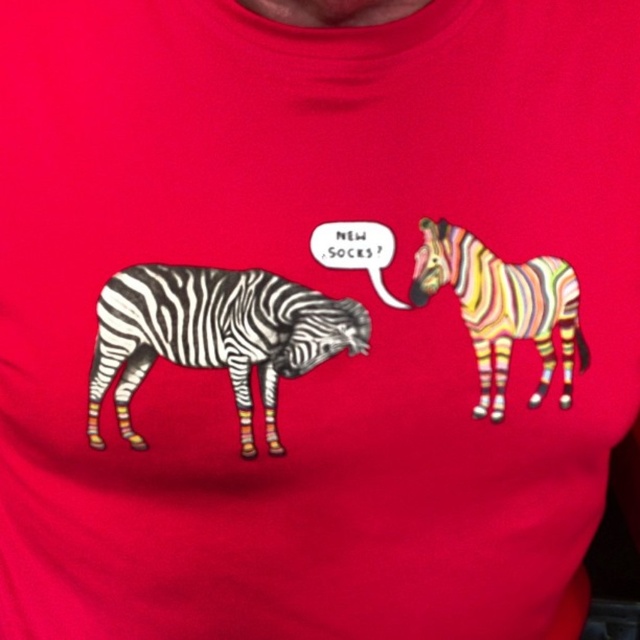
You are trying to decide which zebra on the T shirt is closer to you. You see the black and white striped zebra at left and the rainbow striped zebra at right. Which one is closer?

The black and white striped zebra at left is closer to the viewer than the rainbow striped zebra at right.

You are designing a new T shirt and want to place a text box between the black and white striped zebra at left and the rainbow striped zebra at right. The text box should be centered between them. Which zebra should the text box be closer to?

The text box should be closer to the rainbow striped zebra at right because the black and white striped zebra at left is larger and therefore positioned further away from the rainbow striped zebra at right.

You are looking at a red T shirt with two zebras. The black and white striped zebra at left and the rainbow striped zebra at right. Which zebra is positioned lower on the T shirt?

The black and white striped zebra at left is below rainbow striped zebra at right, so it is positioned lower on the T shirt.